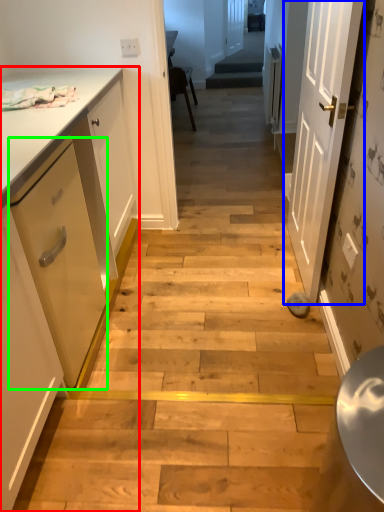
Question: Based on their relative distances, which object is farther from cabinetry (highlighted by a red box)? Choose from door (highlighted by a blue box) and drawer (highlighted by a green box).

Choices:
 (A) door
 (B) drawer

Answer: (A)